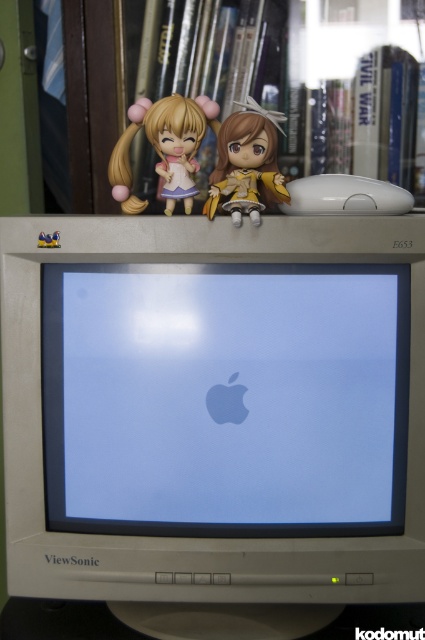
Question: Can you confirm if matte yellow doll at center is wider than matte plastic figurine at upper center?

Choices:
 (A) yes
 (B) no

Answer: (B)

Question: In this image, where is matte yellow doll at center located relative to matte plastic figurine at upper center?

Choices:
 (A) left
 (B) right

Answer: (B)

Question: Does beige plastic monitor at center appear over matte yellow doll at center?

Choices:
 (A) no
 (B) yes

Answer: (A)

Question: Which object is farther from the camera taking this photo?

Choices:
 (A) matte yellow doll at center
 (B) beige plastic monitor at center

Answer: (B)

Question: Which point is farther from the camera taking this photo?

Choices:
 (A) (249, 582)
 (B) (258, 141)

Answer: (B)

Question: Which of the following is the closest to the observer?

Choices:
 (A) matte yellow doll at center
 (B) beige plastic monitor at center

Answer: (A)